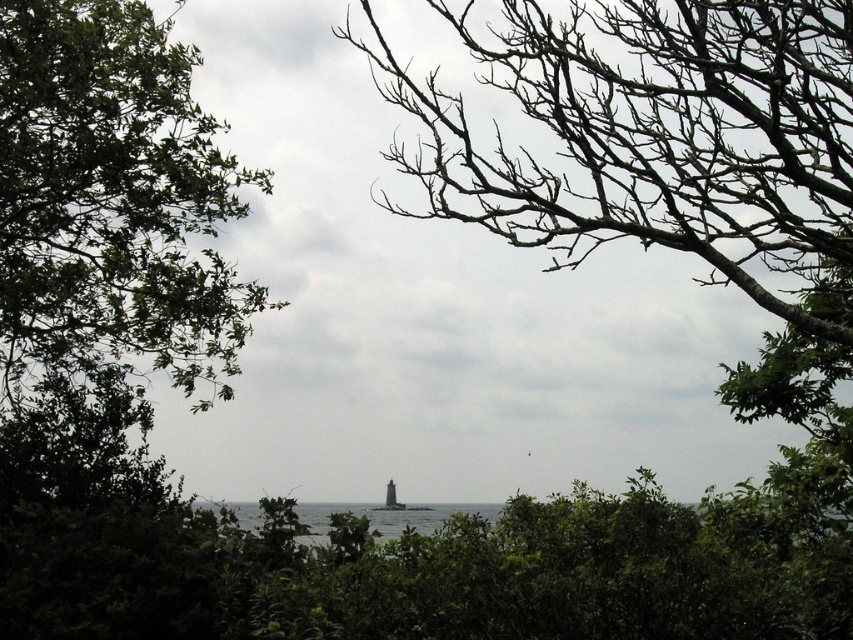
Question: Is brown bark tree at center smaller than green leafy tree at left?

Choices:
 (A) yes
 (B) no

Answer: (B)

Question: Can you confirm if brown bark tree at center is smaller than transparent water at center?

Choices:
 (A) yes
 (B) no

Answer: (B)

Question: Is brown bark tree at center above green leafy tree at left?

Choices:
 (A) yes
 (B) no

Answer: (A)

Question: Which point is closer to the camera?

Choices:
 (A) (757, 49)
 (B) (79, 104)

Answer: (A)

Question: Which is nearer to the transparent water at center?

Choices:
 (A) brown bark tree at center
 (B) green leafy tree at left

Answer: (A)

Question: Among these points, which one is nearest to the camera?

Choices:
 (A) (694, 218)
 (B) (341, 516)
 (C) (132, 80)

Answer: (A)